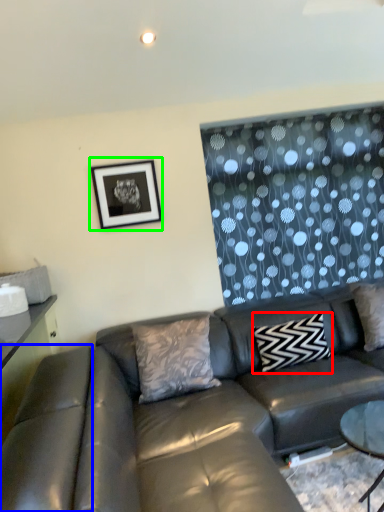
Question: Which is nearer to the pillow (highlighted by a red box)? swivel chair (highlighted by a blue box) or picture frame (highlighted by a green box).

Choices:
 (A) swivel chair
 (B) picture frame

Answer: (B)